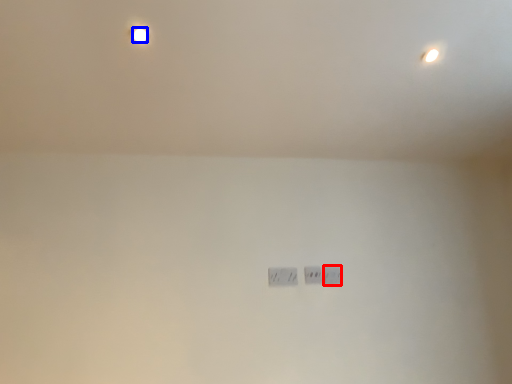
Question: Which of the following is the farthest to the observer, power plugs and sockets (highlighted by a red box) or light bulb (highlighted by a blue box)?

Choices:
 (A) power plugs and sockets
 (B) light bulb

Answer: (A)